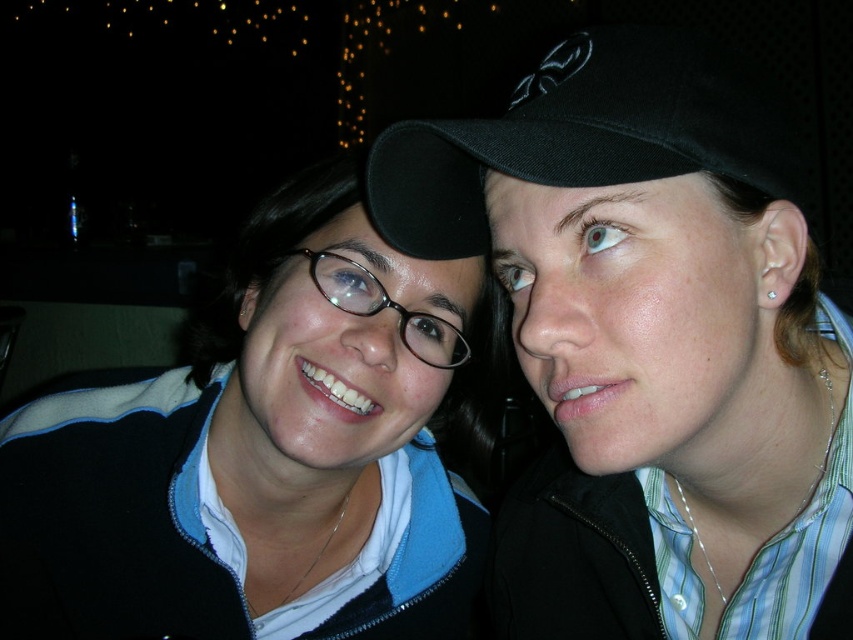
Question: Which of the following is the closest to the observer?

Choices:
 (A) (592, 113)
 (B) (381, 285)
 (C) (49, 557)

Answer: (A)

Question: Can you confirm if matte black jacket at center is positioned to the left of matte black glasses at center?

Choices:
 (A) no
 (B) yes

Answer: (B)

Question: Is black matte cap at upper right bigger than black matte baseball cap at upper center?

Choices:
 (A) no
 (B) yes

Answer: (B)

Question: Which point is farther from the camera taking this photo?

Choices:
 (A) (401, 198)
 (B) (404, 321)

Answer: (B)

Question: Where is matte black jacket at center located in relation to black matte baseball cap at upper center in the image?

Choices:
 (A) above
 (B) below

Answer: (B)

Question: Considering the real-world distances, which object is closest to the matte black jacket at center?

Choices:
 (A) black matte baseball cap at upper center
 (B) matte black glasses at center

Answer: (B)